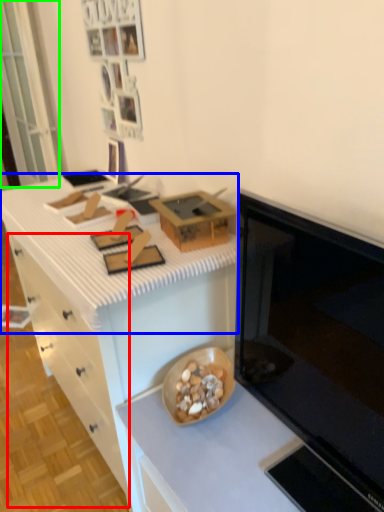
Question: Which object is the farthest from drawer (highlighted by a red box)? Choose among these: countertop (highlighted by a blue box) or glass door (highlighted by a green box).

Choices:
 (A) countertop
 (B) glass door

Answer: (B)